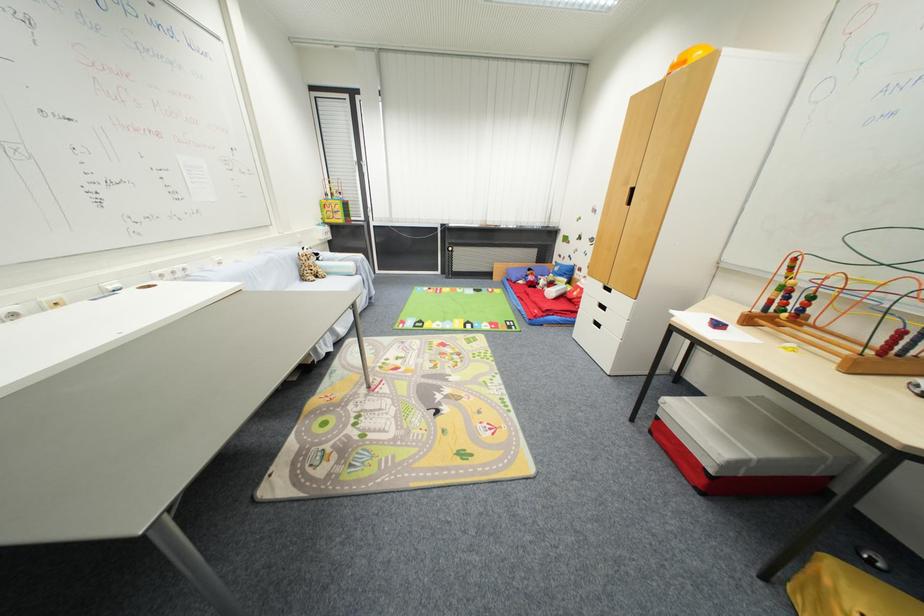
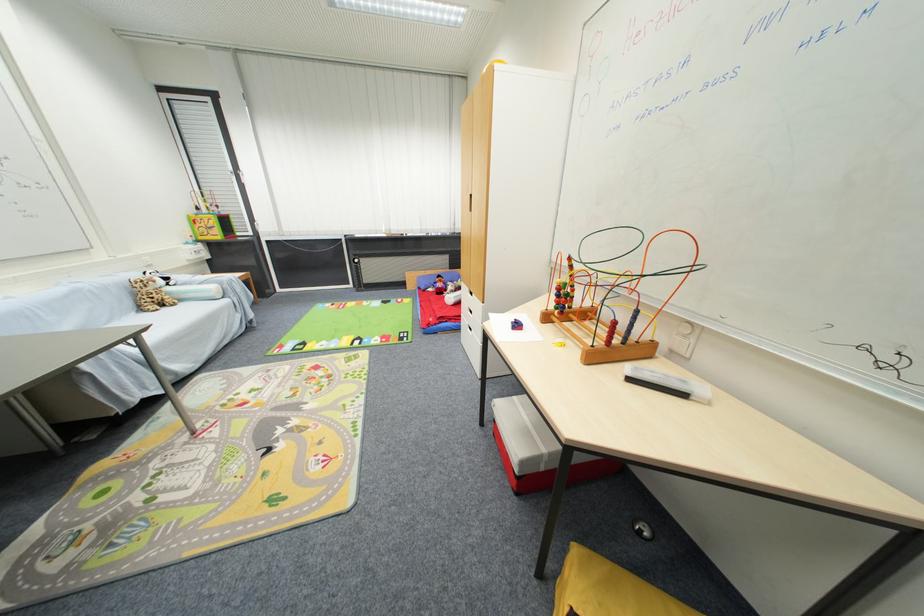
The point at (357, 265) is marked in the first image. Where is the corresponding point in the second image?

(217, 290)